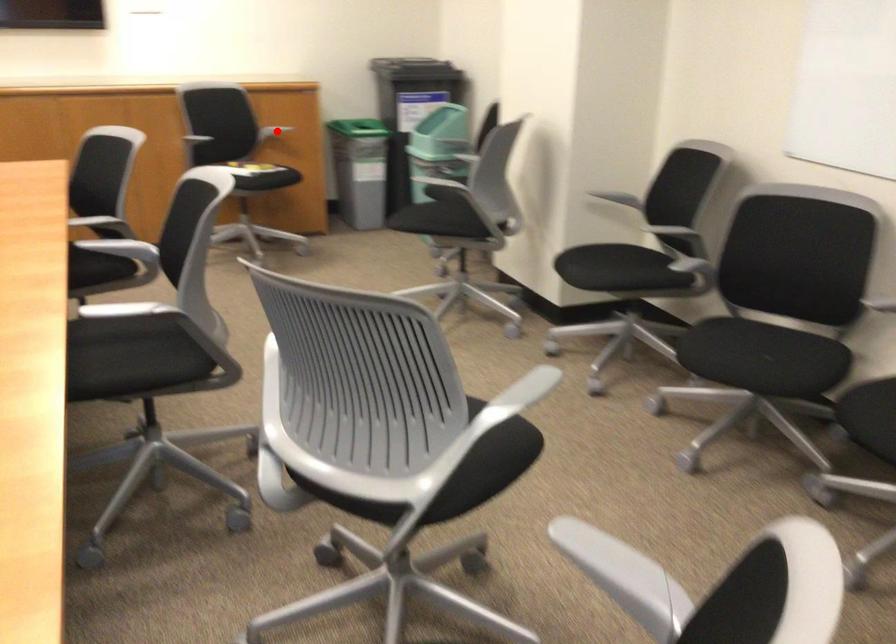
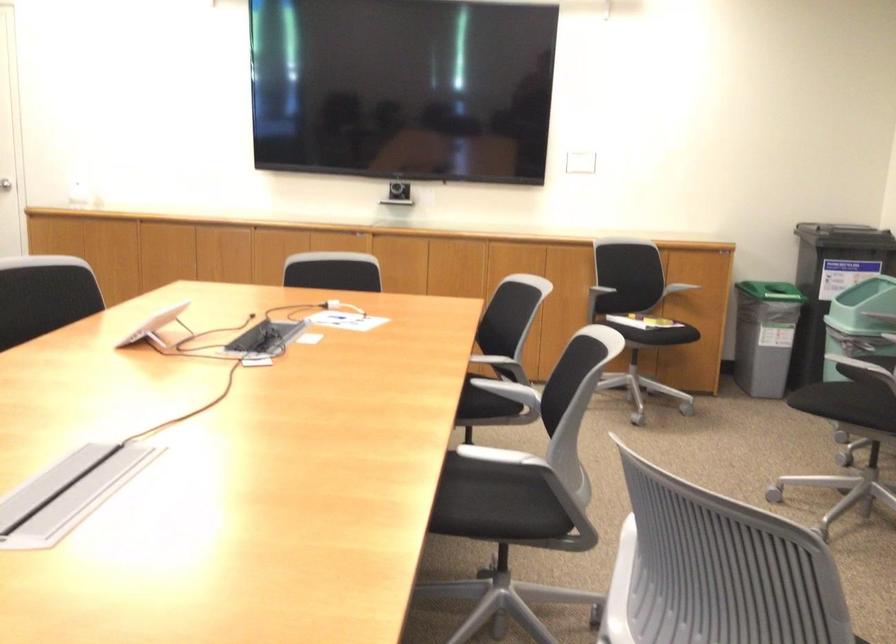
Question: I am providing you with two images of the same scene from different viewpoints. A red point is marked on the first image. Is the red point's position out of view in image 2?

Choices:
 (A) Yes
 (B) No

Answer: (B)